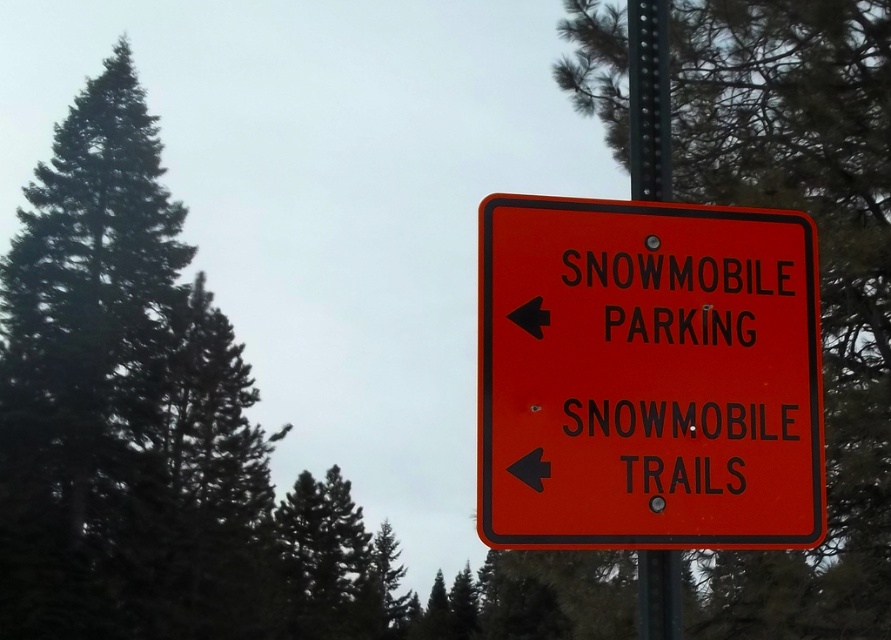
You are standing in front of the orange plastic sign at center and want to attach a new arrow pointing right. Where should you place it relative to the metallic pole at center?

The orange plastic sign at center is below the metallic pole at center, so you should place the new arrow pointing right on the orange plastic sign at center which is located under the metallic pole at center.

You are standing in front of the orange plastic sign at center and want to take a photo of the green textured pine tree at upper right. Since the sign is in the way, can you move to your left or right to avoid it?

The orange plastic sign at center is closer to the viewer than the green textured pine tree at upper right. To take a photo of the green textured pine tree at upper right without the sign blocking it, you should move to your left or right to position yourself so that the sign is no longer in the line of sight between you and the tree.